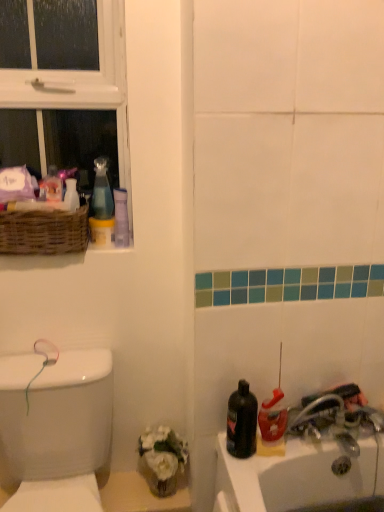
You are a GUI agent. You are given a task and a screenshot of the screen. Output one action in this format:
    pyautogui.click(x=<x>, y=<y>)
    Task: Click on the black matte bottle at lower right
    The width and height of the screenshot is (384, 512).
    Given the screenshot: What is the action you would take?
    pos(241,422)

I want to click on transparent plastic spray bottle at upper left, the first cleaning product in the top-to-bottom sequence, so click(102, 191).

What do you see at coordinates (102, 191) in the screenshot?
I see `transparent plastic spray bottle at upper left, the first cleaning product viewed from the back` at bounding box center [102, 191].

Locate an element on the screen. black matte bottle at lower right is located at coordinates (241, 422).

From a real-world perspective, is transparent plastic spray bottle at upper left, the first cleaning product in the top-to-bottom sequence, above or below white glossy vase at upper left?

transparent plastic spray bottle at upper left, the first cleaning product in the top-to-bottom sequence, is situated higher than white glossy vase at upper left in the real world.

From the image's perspective, is transparent plastic spray bottle at upper left, which appears as the second cleaning product when viewed from the front, located above or below white glossy vase at upper left?

From the image's perspective, transparent plastic spray bottle at upper left, which appears as the second cleaning product when viewed from the front, appears above white glossy vase at upper left.

Can you confirm if transparent plastic spray bottle at upper left, the second cleaning product ordered from the bottom, is shorter than white glossy vase at upper left?

Incorrect, the height of transparent plastic spray bottle at upper left, the second cleaning product ordered from the bottom, does not fall short of that of white glossy vase at upper left.

At what (x,y) coordinates should I click in order to perform the action: click on cleaning product above the white glossy vase at upper left (from the image's perspective). Please return your answer as a coordinate pair (x, y). Image resolution: width=384 pixels, height=512 pixels. Looking at the image, I should click on (102, 191).

Is translucent plastic spray bottle at lower right, which is the first cleaning product from front to back, at the right side of transparent plastic spray bottle at upper left, the first cleaning product in the left-to-right sequence?

Answer: Yes.

From a real-world perspective, is translucent plastic spray bottle at lower right, placed as the first cleaning product when sorted from right to left, physically located above or below transparent plastic spray bottle at upper left, the first cleaning product in the top-to-bottom sequence?

translucent plastic spray bottle at lower right, placed as the first cleaning product when sorted from right to left, is situated lower than transparent plastic spray bottle at upper left, the first cleaning product in the top-to-bottom sequence, in the real world.

Which is closer to the camera, (267, 446) or (97, 172)?

Point (267, 446)

Is translucent plastic spray bottle at lower right, marked as the 1th cleaning product in a bottom-to-top arrangement, positioned before transparent plastic spray bottle at upper left, acting as the 2th cleaning product starting from the right?

Answer: Yes, translucent plastic spray bottle at lower right, marked as the 1th cleaning product in a bottom-to-top arrangement, is closer to the viewer.

The width and height of the screenshot is (384, 512). Identify the location of toiletry on the left of translucent plastic spray bottle at lower right, which ranks as the second cleaning product in top-to-bottom order. (71, 195).

Is translucent plastic spray bottle at lower right, arranged as the second cleaning product when viewed from the back, outside of white glossy vase at upper left?

Yes.

From a real-world perspective, is translucent plastic spray bottle at lower right, which is the first cleaning product from front to back, physically above white glossy vase at upper left?

Incorrect, from a real-world perspective, translucent plastic spray bottle at lower right, which is the first cleaning product from front to back, is lower than white glossy vase at upper left.

In terms of width, does translucent plastic spray bottle at lower right, which ranks as the second cleaning product in top-to-bottom order, look wider or thinner when compared to white glossy vase at upper left?

Considering their sizes, translucent plastic spray bottle at lower right, which ranks as the second cleaning product in top-to-bottom order, looks broader than white glossy vase at upper left.

Locate an element on the screen. This screenshot has height=512, width=384. the 2nd cleaning product behind when counting from the metallic silver faucet at lower right is located at coordinates (102, 191).

Is metallic silver faucet at lower right to the right of transparent plastic spray bottle at upper left, the first cleaning product viewed from the back, from the viewer's perspective?

Yes, metallic silver faucet at lower right is to the right of transparent plastic spray bottle at upper left, the first cleaning product viewed from the back.

Can you tell me how much metallic silver faucet at lower right and transparent plastic spray bottle at upper left, which appears as the second cleaning product when viewed from the front, differ in facing direction?

0.933 degrees.

Is point (324, 417) farther from camera compared to point (94, 160)?

That is False.

Is white glossy vase at upper left far from metallic silver faucet at lower right?

That's not correct — white glossy vase at upper left is a little close to metallic silver faucet at lower right.

Between white glossy vase at upper left and metallic silver faucet at lower right, which one has smaller width?

With smaller width is white glossy vase at upper left.

Considering the points (72, 188) and (353, 446), which point is behind, point (72, 188) or point (353, 446)?

The point (353, 446) is more distant.

Could black matte bottle at lower right be considered to be inside translucent plastic spray bottle at lower right, which is the first cleaning product from front to back?

No, black matte bottle at lower right is located outside of translucent plastic spray bottle at lower right, which is the first cleaning product from front to back.

Does point (280, 455) come closer to viewer compared to point (227, 444)?

Yes, point (280, 455) is closer to viewer.

Between translucent plastic spray bottle at lower right, marked as the 1th cleaning product in a bottom-to-top arrangement, and black matte bottle at lower right, which one has smaller size?

Smaller between the two is translucent plastic spray bottle at lower right, marked as the 1th cleaning product in a bottom-to-top arrangement.

Image resolution: width=384 pixels, height=512 pixels. Identify the location of mouthwash on the left of translucent plastic spray bottle at lower right, placed as the first cleaning product when sorted from right to left. (241, 422).

From a real-world perspective, is white plastic window at upper left physically below metallic silver faucet at lower right?

Actually, white plastic window at upper left is physically above metallic silver faucet at lower right in the real world.

The image size is (384, 512). Find the location of `tap lying in front of the white plastic window at upper left`. tap lying in front of the white plastic window at upper left is located at coordinates (331, 419).

Is white plastic window at upper left to the right of metallic silver faucet at lower right from the viewer's perspective?

In fact, white plastic window at upper left is to the left of metallic silver faucet at lower right.

Is metallic silver faucet at lower right completely or partially inside white plastic window at upper left?

No, metallic silver faucet at lower right is not surrounded by white plastic window at upper left.

This screenshot has width=384, height=512. In order to click on toiletry in front of the transparent plastic spray bottle at upper left, the first cleaning product in the left-to-right sequence in this screenshot , I will do `click(71, 195)`.

The height and width of the screenshot is (512, 384). I want to click on cleaning product below the transparent plastic spray bottle at upper left, the second cleaning product ordered from the bottom (from a real-world perspective), so click(272, 422).

Which object lies further to the anchor point black matte bottle at lower right, white glossy vase at upper left or white plastic window at upper left?

white plastic window at upper left lies further to black matte bottle at lower right than the other object.

When comparing their distances from white plastic window at upper left, does metallic silver faucet at lower right or translucent plastic spray bottle at lower right, acting as the 2th cleaning product starting from the left, seem closer?

translucent plastic spray bottle at lower right, acting as the 2th cleaning product starting from the left.

Estimate the real-world distances between objects in this image. Which object is further from black matte bottle at lower right, woven brown basket at upper left or white glossy vase at upper left?

Based on the image, white glossy vase at upper left appears to be further to black matte bottle at lower right.

When comparing their distances from black matte bottle at lower right, does transparent plastic spray bottle at upper left, the first cleaning product in the top-to-bottom sequence, or white plastic window at upper left seem closer?

The object closer to black matte bottle at lower right is transparent plastic spray bottle at upper left, the first cleaning product in the top-to-bottom sequence.

When comparing their distances from woven brown basket at upper left, does transparent plastic spray bottle at upper left, the first cleaning product in the left-to-right sequence, or translucent plastic spray bottle at lower right, which ranks as the second cleaning product in top-to-bottom order, seem further?

translucent plastic spray bottle at lower right, which ranks as the second cleaning product in top-to-bottom order, is further to woven brown basket at upper left.

Looking at the image, which one is located further to white glossy vase at upper left, transparent plastic spray bottle at upper left, the first cleaning product in the left-to-right sequence, or black matte bottle at lower right?

black matte bottle at lower right.

From the image, which object appears to be farther from black matte bottle at lower right, white plastic window at upper left or white glossy porcelain at left?

Among the two, white plastic window at upper left is located further to black matte bottle at lower right.

Based on their spatial positions, is translucent plastic spray bottle at lower right, arranged as the second cleaning product when viewed from the back, or white glossy porcelain at left closer to metallic silver faucet at lower right?

translucent plastic spray bottle at lower right, arranged as the second cleaning product when viewed from the back.

Locate an element on the screen. mouthwash situated between white glossy porcelain at left and translucent plastic spray bottle at lower right, acting as the 2th cleaning product starting from the left, from left to right is located at coordinates (241, 422).

Where is `basket between white plastic window at upper left and translucent plastic spray bottle at lower right, acting as the 2th cleaning product starting from the left, in the vertical direction`? basket between white plastic window at upper left and translucent plastic spray bottle at lower right, acting as the 2th cleaning product starting from the left, in the vertical direction is located at coordinates (44, 232).

In order to click on basket between white plastic window at upper left and black matte bottle at lower right in the up-down direction in this screenshot , I will do `click(44, 232)`.

Locate an element on the screen. toiletry situated between woven brown basket at upper left and metallic silver faucet at lower right from left to right is located at coordinates (71, 195).